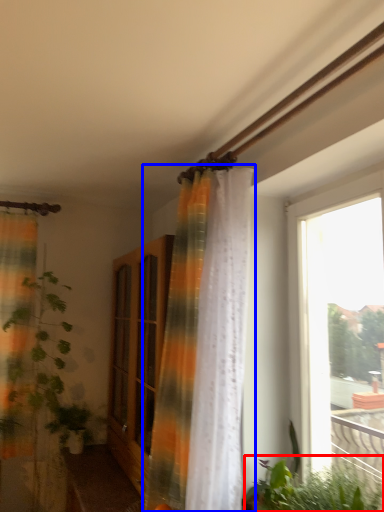
Question: Which of the following is the closest to the observer, vegetation (highlighted by a red box) or curtain (highlighted by a blue box)?

Choices:
 (A) vegetation
 (B) curtain

Answer: (A)